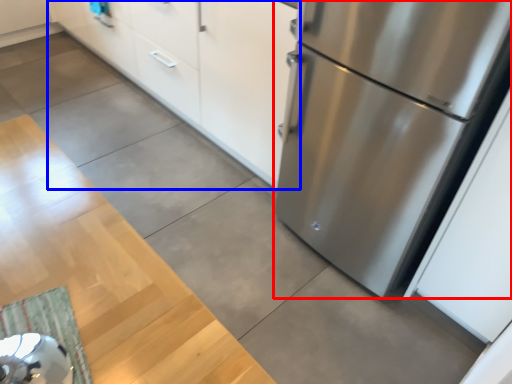
Question: Which object appears farthest to the camera in this image, refrigerator (highlighted by a red box) or cabinetry (highlighted by a blue box)?

Choices:
 (A) refrigerator
 (B) cabinetry

Answer: (B)